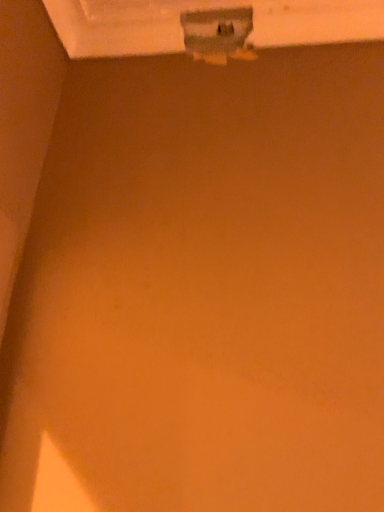
This screenshot has height=512, width=384. Identify the location of metallic gray window frame at upper center. (206, 9).

What do you see at coordinates (206, 9) in the screenshot? I see `metallic gray window frame at upper center` at bounding box center [206, 9].

At what (x,y) coordinates should I click in order to perform the action: click on metallic gray window frame at upper center. Please return your answer as a coordinate pair (x, y). This screenshot has height=512, width=384. Looking at the image, I should click on (206, 9).